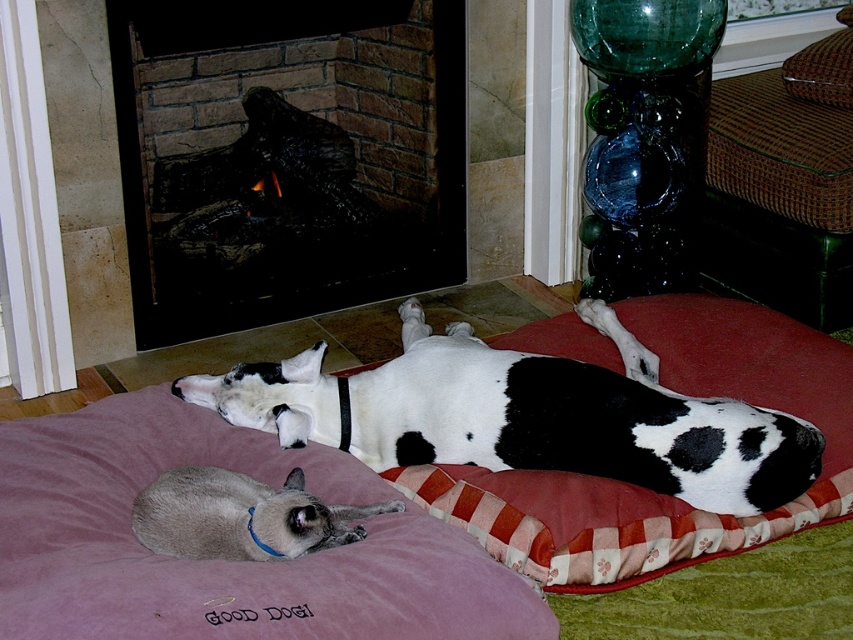
You are a pet sitter who needs to move the silky gray cat at lower left to another room. The velvet purple cat bed at lower left is in the way. Can you lift the bed first without disturbing the cat?

The velvet purple cat bed at lower left has a larger size compared to silky gray cat at lower left, so it can be lifted first without disturbing the cat since the bed is bigger and provides more space around the cat to handle it carefully.

You are a photographer standing in the living room and want to take a photo of the brick fireplace at upper left and the silky gray cat at lower left. Which object is closer to you?

The brick fireplace at upper left is closer to you than the silky gray cat at lower left because it is further to the viewer.

You are a pet owner who wants to place a new toy between the velvet purple cat bed at lower left and the silky gray cat at lower left. Can you fit the toy in that space?

The velvet purple cat bed at lower left is below the silky gray cat at lower left, so there is no horizontal space between them to place the toy. The toy would need to be placed elsewhere.